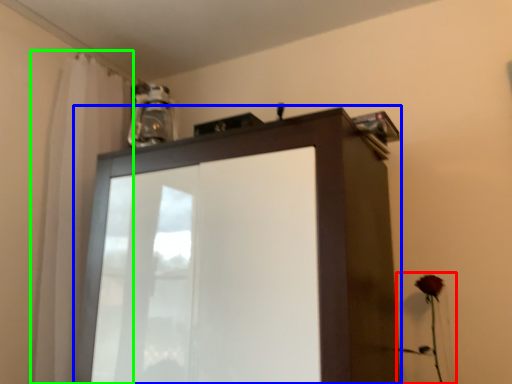
Question: Which object is positioned farthest from flower (highlighted by a red box)? Select from cupboard (highlighted by a blue box) and shower curtain (highlighted by a green box).

Choices:
 (A) cupboard
 (B) shower curtain

Answer: (B)